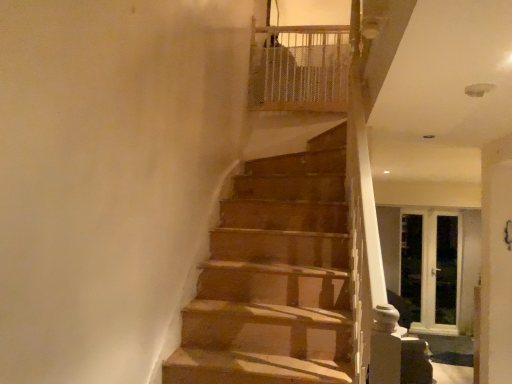
Question: Does white wooden screen door at right, positioned as the second screen door in left-to-right order, have a lesser height compared to clear glass screen door at right, acting as the 3th screen door starting from the right?

Choices:
 (A) no
 (B) yes

Answer: (B)

Question: Is white wooden screen door at right, positioned as the second screen door in left-to-right order, taller than clear glass screen door at right, acting as the 3th screen door starting from the right?

Choices:
 (A) yes
 (B) no

Answer: (B)

Question: Considering the relative positions of white wooden screen door at right, which is the 2th screen door from right to left, and clear glass screen door at right, which ranks as the 1th screen door in left-to-right order, in the image provided, is white wooden screen door at right, which is the 2th screen door from right to left, to the left of clear glass screen door at right, which ranks as the 1th screen door in left-to-right order, from the viewer's perspective?

Choices:
 (A) yes
 (B) no

Answer: (B)

Question: Is white wooden screen door at right, positioned as the second screen door in left-to-right order, looking in the opposite direction of clear glass screen door at right, acting as the 3th screen door starting from the right?

Choices:
 (A) no
 (B) yes

Answer: (B)

Question: From the image's perspective, is white wooden screen door at right, positioned as the second screen door in left-to-right order, on clear glass screen door at right, which ranks as the 1th screen door in left-to-right order?

Choices:
 (A) yes
 (B) no

Answer: (B)

Question: Is white wooden screen door at right, which is the 2th screen door from right to left, to the right of clear glass screen door at right, which ranks as the 1th screen door in left-to-right order, from the viewer's perspective?

Choices:
 (A) yes
 (B) no

Answer: (A)

Question: Is white mesh balustrade at upper center far from white glass screen door at right, arranged as the third screen door when viewed from the left?

Choices:
 (A) yes
 (B) no

Answer: (A)

Question: Is white mesh balustrade at upper center at the right side of white glass screen door at right, arranged as the third screen door when viewed from the left?

Choices:
 (A) yes
 (B) no

Answer: (B)

Question: Can you confirm if white mesh balustrade at upper center is shorter than white glass screen door at right, the first screen door in the right-to-left sequence?

Choices:
 (A) yes
 (B) no

Answer: (A)

Question: From a real-world perspective, is white mesh balustrade at upper center on top of white glass screen door at right, arranged as the third screen door when viewed from the left?

Choices:
 (A) yes
 (B) no

Answer: (A)

Question: Can you confirm if white mesh balustrade at upper center is smaller than white glass screen door at right, arranged as the third screen door when viewed from the left?

Choices:
 (A) no
 (B) yes

Answer: (A)

Question: Can you confirm if white mesh balustrade at upper center is wider than white glass screen door at right, arranged as the third screen door when viewed from the left?

Choices:
 (A) no
 (B) yes

Answer: (B)

Question: Does white glass screen door at right, the first screen door in the right-to-left sequence, have a smaller size compared to white wooden screen door at right, which is the 2th screen door from right to left?

Choices:
 (A) no
 (B) yes

Answer: (B)